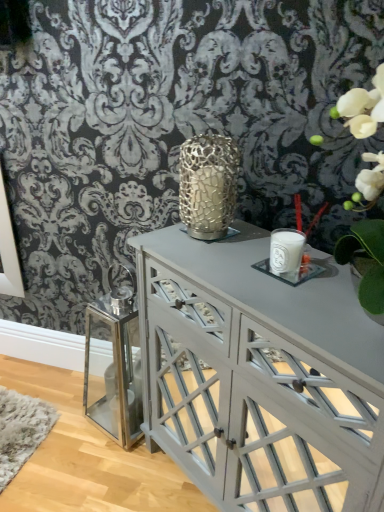
I want to click on vacant space in between gold textured candle holder at center, acting as the first candle holder starting from the left, and white glass candle at center, marked as the 2th candle holder in a top-to-bottom arrangement, so click(243, 254).